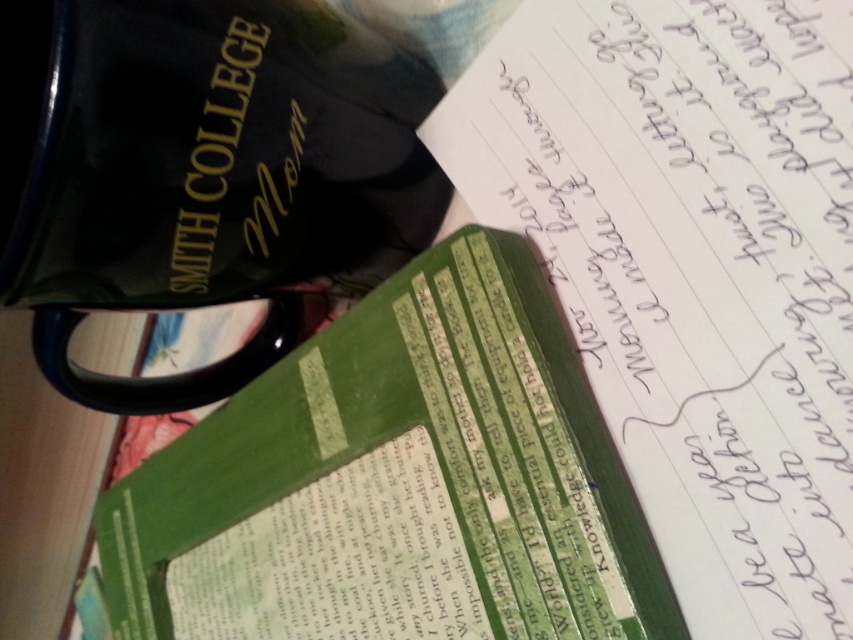
You are organizing your desk and need to know the position of the green textured notebook at center and the green paper notebook at center. Which one is placed higher on the desk?

The green textured notebook at center is placed higher on the desk since it is above the green paper notebook at center.

You are organizing a study area and need to place a new item between the two points labeled as point (645, 36) and point (283, 627). Given their positions, where should you place the new item so that it is equidistant from both points?

To place the new item equidistant from both points, you should position it at the midpoint between point (645, 36) and point (283, 627). The midpoint coordinates would be calculated by averaging the x and y values of both points, resulting in the point 0.519, 0.545.